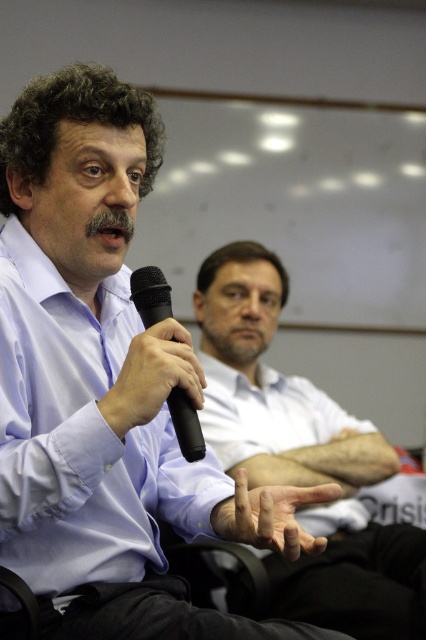
From the picture: You are an event planner setting up for a presentation. You need to ensure that the matte black microphone at center is visible to the audience. Considering the smooth skin hand at center is holding it, where should the hand position the microphone relative to the hand to keep it in view?

The matte black microphone at center should be positioned above the smooth skin hand at center to remain visible to the audience.

You are organizing a conference and need to set up two microphones for a panel discussion. The stage has a podium in the center and a table on the left. Based on the image, where should you place the matte black microphone at center and the black matte microphone at left?

The matte black microphone at center should be placed on the podium in the center of the stage, while the black matte microphone at left should be placed on the table on the left. According to the image, the matte black microphone at center is positioned below the black matte microphone at left, indicating their respective locations on the stage.